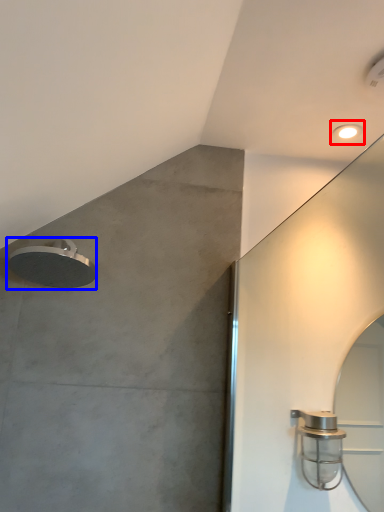
Question: Which of the following is the farthest to the observer, droplight (highlighted by a red box) or shower (highlighted by a blue box)?

Choices:
 (A) droplight
 (B) shower

Answer: (A)